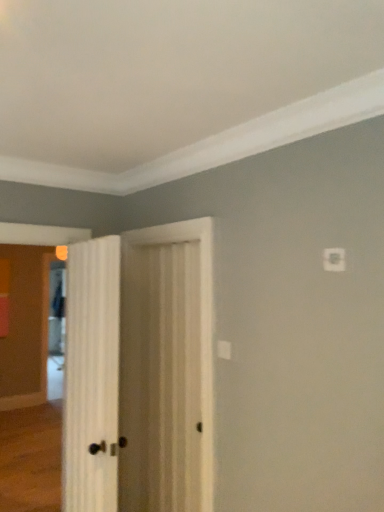
How much space does white wood door at center, which appears as the second door when viewed from the left, occupy horizontally?

white wood door at center, which appears as the second door when viewed from the left, is 2.34 inches in width.

Locate an element on the screen. white wood door at center, which is the second door in right-to-left order is located at coordinates (91, 377).

What do you see at coordinates (91, 377) in the screenshot? This screenshot has width=384, height=512. I see `white wood door at center, arranged as the first door when viewed from the left` at bounding box center [91, 377].

Where is `clear glass screen door at left`? clear glass screen door at left is located at coordinates (56, 330).

From the image's perspective, who appears lower, white wood door at center, arranged as the first door when viewed from the left, or white wood door at center, which appears as the second door when viewed from the left?

white wood door at center, arranged as the first door when viewed from the left, from the image's perspective.

Is white wood door at center, arranged as the first door when viewed from the left, wider than white wood door at center, which appears as the second door when viewed from the left?

Correct, the width of white wood door at center, arranged as the first door when viewed from the left, exceeds that of white wood door at center, which appears as the second door when viewed from the left.

Find the location of a particular element. The width and height of the screenshot is (384, 512). door below the white wood door at center, which is the 1th door in right-to-left order (from the image's perspective) is located at coordinates (91, 377).

Can you confirm if white wood door at center, arranged as the first door when viewed from the left, is smaller than white wood door at center, which is the 1th door in right-to-left order?

No, white wood door at center, arranged as the first door when viewed from the left, is not smaller than white wood door at center, which is the 1th door in right-to-left order.

Are white wood door at center, arranged as the first door when viewed from the left, and clear glass screen door at left located far from each other?

Yes.

How far apart are white wood door at center, which is the second door in right-to-left order, and clear glass screen door at left?

A distance of 3.87 meters exists between white wood door at center, which is the second door in right-to-left order, and clear glass screen door at left.

Looking at this image, from a real-world perspective, is white wood door at center, arranged as the first door when viewed from the left, above or below clear glass screen door at left?

white wood door at center, arranged as the first door when viewed from the left, is above clear glass screen door at left.

Locate an element on the screen. Image resolution: width=384 pixels, height=512 pixels. screen door below the white wood door at center, arranged as the first door when viewed from the left (from a real-world perspective) is located at coordinates (56, 330).

Locate an element on the screen. the 1st door above when counting from the clear glass screen door at left (from the image's perspective) is located at coordinates (91, 377).

Considering the sizes of clear glass screen door at left and white wood door at center, which is the second door in right-to-left order, in the image, is clear glass screen door at left taller or shorter than white wood door at center, which is the second door in right-to-left order,?

clear glass screen door at left is taller than white wood door at center, which is the second door in right-to-left order.

Considering the relative sizes of clear glass screen door at left and white wood door at center, which is the second door in right-to-left order, in the image provided, is clear glass screen door at left thinner than white wood door at center, which is the second door in right-to-left order,?

No.

Are white wood door at center, which appears as the second door when viewed from the left, and clear glass screen door at left beside each other?

white wood door at center, which appears as the second door when viewed from the left, and clear glass screen door at left are not in contact.

From a real-world perspective, is white wood door at center, which appears as the second door when viewed from the left, positioned above or below clear glass screen door at left?

Clearly, from a real-world perspective, white wood door at center, which appears as the second door when viewed from the left, is above clear glass screen door at left.

Is white wood door at center, which is the 1th door in right-to-left order, located outside clear glass screen door at left?

white wood door at center, which is the 1th door in right-to-left order, is positioned outside clear glass screen door at left.

Between white wood door at center, which is the 1th door in right-to-left order, and clear glass screen door at left, which one has larger size?

With larger size is clear glass screen door at left.

Would you say white wood door at center, which is the 1th door in right-to-left order, is outside white wood door at center, which is the second door in right-to-left order?

Absolutely, white wood door at center, which is the 1th door in right-to-left order, is external to white wood door at center, which is the second door in right-to-left order.

How different are the orientations of white wood door at center, which is the 1th door in right-to-left order, and white wood door at center, which is the second door in right-to-left order, in degrees?

white wood door at center, which is the 1th door in right-to-left order, and white wood door at center, which is the second door in right-to-left order, are facing 7.42 degrees away from each other.

Is white wood door at center, which is the 1th door in right-to-left order, placed right next to white wood door at center, arranged as the first door when viewed from the left?

No, white wood door at center, which is the 1th door in right-to-left order, is not with white wood door at center, arranged as the first door when viewed from the left.

Which door is the 2nd one when counting from the right side of the clear glass screen door at left? Please provide its 2D coordinates.

[(160, 379)]

Based on the photo, is the position of clear glass screen door at left less distant than that of white wood door at center, which appears as the second door when viewed from the left?

No, the depth of clear glass screen door at left is greater than that of white wood door at center, which appears as the second door when viewed from the left.

Based on the photo, considering the sizes of objects clear glass screen door at left and white wood door at center, which is the 1th door in right-to-left order, in the image provided, who is shorter, clear glass screen door at left or white wood door at center, which is the 1th door in right-to-left order,?

white wood door at center, which is the 1th door in right-to-left order, is shorter.

Which object is positioned more to the left, clear glass screen door at left or white wood door at center, which is the 1th door in right-to-left order?

Positioned to the left is clear glass screen door at left.

Image resolution: width=384 pixels, height=512 pixels. I want to click on door in front of the white wood door at center, which is the 1th door in right-to-left order, so click(x=91, y=377).

Find the location of a particular element. The image size is (384, 512). screen door behind the white wood door at center, arranged as the first door when viewed from the left is located at coordinates (56, 330).

When comparing their distances from white wood door at center, which is the second door in right-to-left order, does clear glass screen door at left or white wood door at center, which is the 1th door in right-to-left order, seem further?

The object further to white wood door at center, which is the second door in right-to-left order, is clear glass screen door at left.

From the image, which object appears to be nearer to clear glass screen door at left, white wood door at center, which is the second door in right-to-left order, or white wood door at center, which appears as the second door when viewed from the left?

Among the two, white wood door at center, which appears as the second door when viewed from the left, is located nearer to clear glass screen door at left.

In the scene shown: Which object lies nearer to the anchor point white wood door at center, which is the 1th door in right-to-left order, white wood door at center, which is the second door in right-to-left order, or clear glass screen door at left?

Based on the image, white wood door at center, which is the second door in right-to-left order, appears to be nearer to white wood door at center, which is the 1th door in right-to-left order.

Looking at the image, which one is located further to white wood door at center, which appears as the second door when viewed from the left, clear glass screen door at left or white wood door at center, arranged as the first door when viewed from the left?

clear glass screen door at left lies further to white wood door at center, which appears as the second door when viewed from the left, than the other object.

From the image, which object appears to be farther from clear glass screen door at left, white wood door at center, which is the 1th door in right-to-left order, or white wood door at center, arranged as the first door when viewed from the left?

white wood door at center, arranged as the first door when viewed from the left.

Based on their spatial positions, is white wood door at center, which is the 1th door in right-to-left order, or clear glass screen door at left further from white wood door at center, which is the second door in right-to-left order?

clear glass screen door at left lies further to white wood door at center, which is the second door in right-to-left order, than the other object.

This screenshot has height=512, width=384. What are the coordinates of `door between white wood door at center, which is the second door in right-to-left order, and clear glass screen door at left, along the z-axis` in the screenshot? It's located at (160, 379).